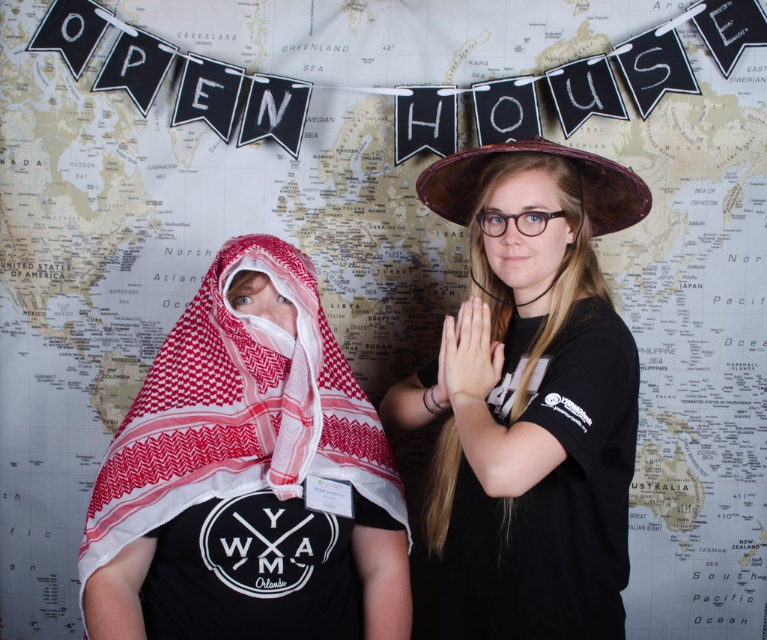
In the scene shown: Which of these two, red and white woven cloth at left or black matte hat at center, stands taller?

black matte hat at center is taller.

At what (x,y) coordinates should I click in order to perform the action: click on red and white woven cloth at left. Please return your answer as a coordinate pair (x, y). The image size is (767, 640). Looking at the image, I should click on (247, 476).